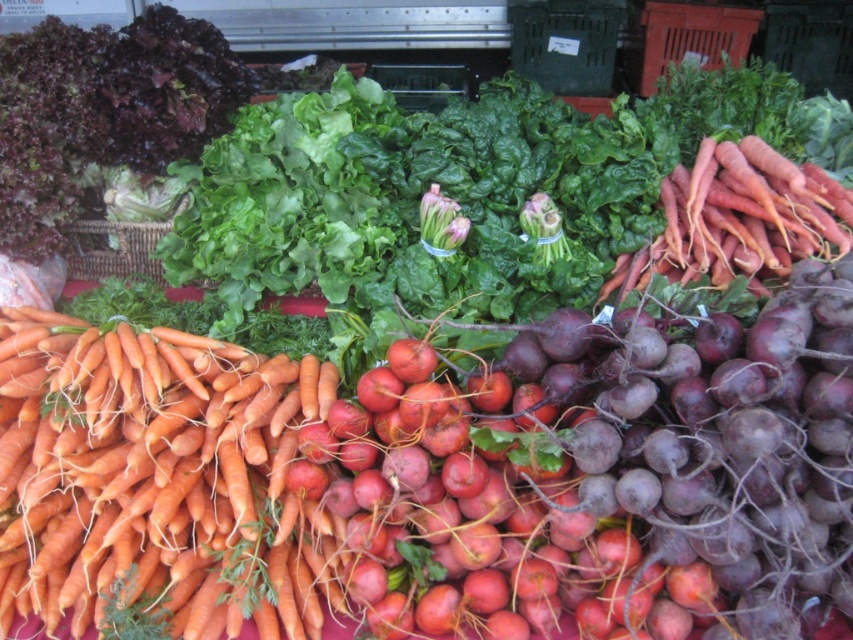
Question: Can you confirm if orange matte carrots at left is bigger than orange matte carrots at upper right?

Choices:
 (A) yes
 (B) no

Answer: (A)

Question: Which of the following is the closest to the observer?

Choices:
 (A) coord(799,221)
 (B) coord(167,502)

Answer: (B)

Question: Among these objects, which one is farthest from the camera?

Choices:
 (A) orange matte carrots at upper right
 (B) orange matte carrots at left

Answer: (A)

Question: Which point is farther to the camera?

Choices:
 (A) (252, 412)
 (B) (705, 205)

Answer: (B)

Question: Is orange matte carrots at left to the left of orange matte carrots at upper right from the viewer's perspective?

Choices:
 (A) yes
 (B) no

Answer: (A)

Question: Can you confirm if orange matte carrots at left is thinner than orange matte carrots at upper right?

Choices:
 (A) no
 (B) yes

Answer: (A)